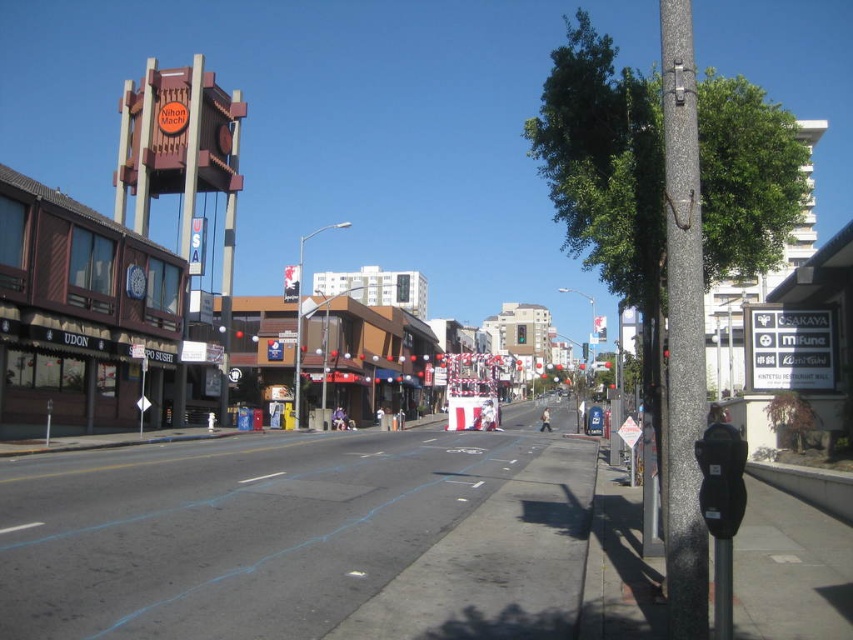
Question: Where is granite pole at right located in relation to black plastic parking meter at right in the image?

Choices:
 (A) right
 (B) left

Answer: (A)

Question: Among these objects, which one is farthest from the camera?

Choices:
 (A) granite pole at right
 (B) black plastic parking meter at right

Answer: (A)

Question: Is the position of granite pole at right less distant than that of black plastic parking meter at right?

Choices:
 (A) no
 (B) yes

Answer: (A)

Question: Does granite pole at right appear over black plastic parking meter at right?

Choices:
 (A) no
 (B) yes

Answer: (B)